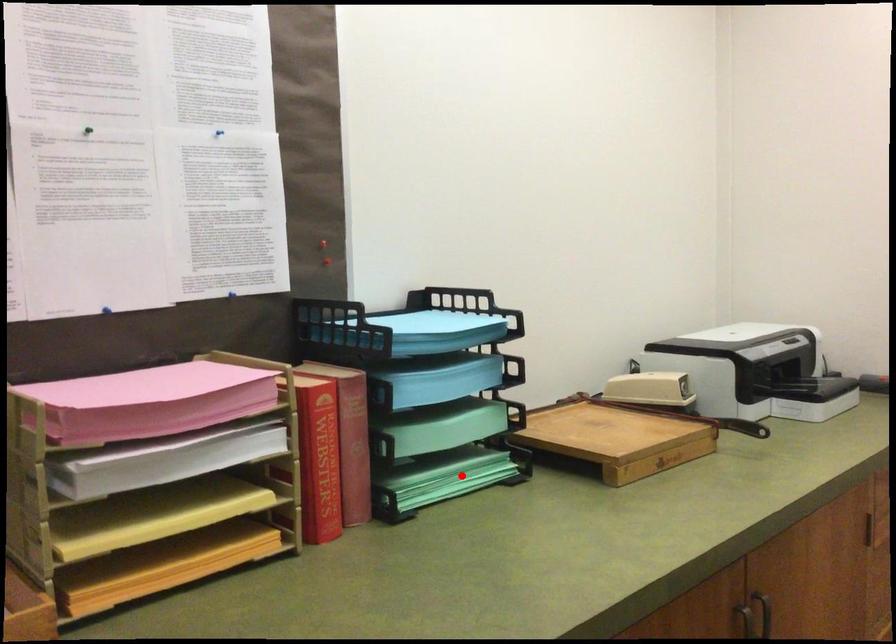
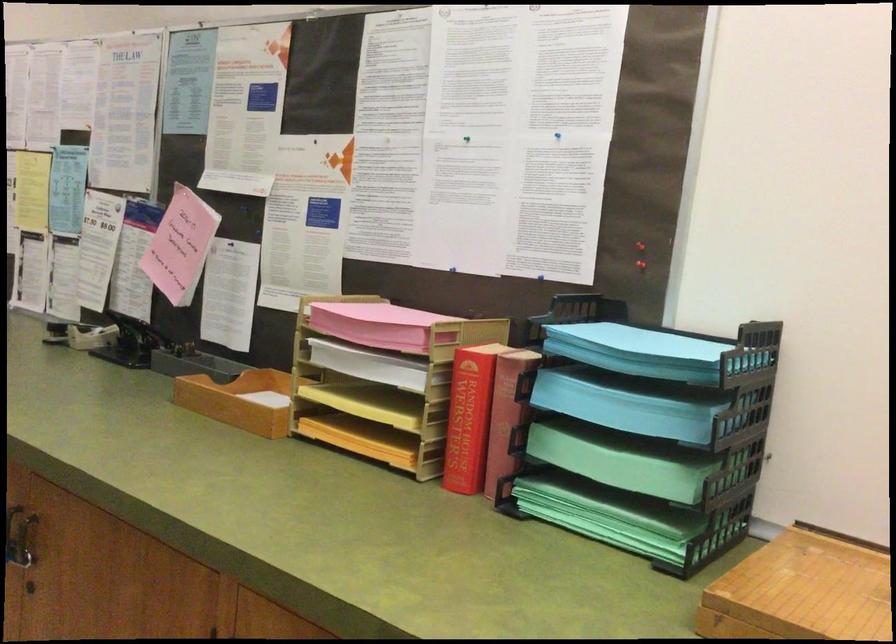
Question: I am providing you with two images of the same scene from different viewpoints. Given a red point in image1, look at the same physical point in image2. Is it:

Choices:
 (A) Closer to the viewpoint
 (B) Farther from the viewpoint

Answer: (A)